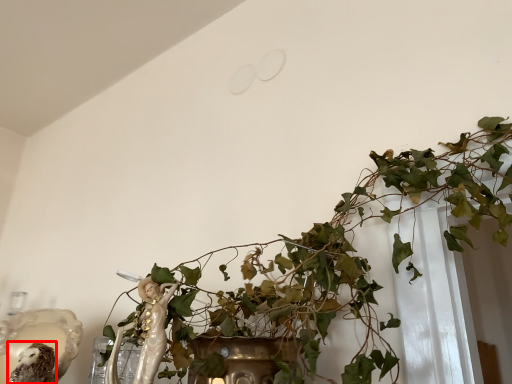
Question: From the image's perspective, where is animal (annotated by the red box) located relative to houseplant?

Choices:
 (A) above
 (B) below

Answer: (B)